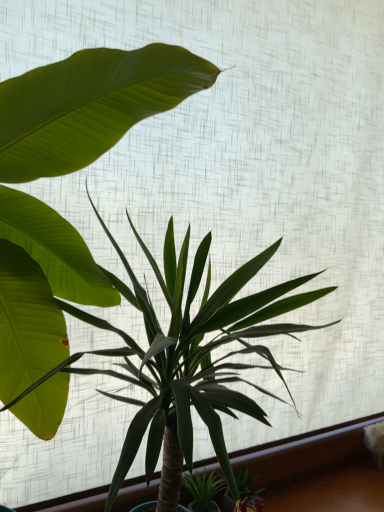
Question: From the image's perspective, would you say green leafy plant at center, the 1th houseplant from the right, is shown under green leafy plant at center, which appears as the first houseplant when viewed from the left?

Choices:
 (A) yes
 (B) no

Answer: (A)

Question: Considering the relative sizes of green leafy plant at center, the 1th houseplant from the right, and green leafy plant at center, which appears as the first houseplant when viewed from the left, in the image provided, is green leafy plant at center, the 1th houseplant from the right, wider than green leafy plant at center, which appears as the first houseplant when viewed from the left,?

Choices:
 (A) no
 (B) yes

Answer: (B)

Question: Is green leafy plant at center, which appears as the first houseplant when viewed from the left, at the back of green leafy plant at center, which is counted as the second houseplant, starting from the left?

Choices:
 (A) no
 (B) yes

Answer: (B)

Question: Does green leafy plant at center, which is counted as the second houseplant, starting from the left, appear on the right side of green leafy plant at center, which is counted as the second houseplant, starting from the right?

Choices:
 (A) no
 (B) yes

Answer: (B)

Question: Is green leafy plant at center, the 1th houseplant from the right, placed right next to green leafy plant at center, which appears as the first houseplant when viewed from the left?

Choices:
 (A) yes
 (B) no

Answer: (B)

Question: Is green leafy plant at center, which is counted as the second houseplant, starting from the left, thinner than green leafy plant at center, which is counted as the second houseplant, starting from the right?

Choices:
 (A) no
 (B) yes

Answer: (A)

Question: Would you say green leafy plant at center, which appears as the first houseplant when viewed from the left, contains green leafy plant at lower center?

Choices:
 (A) yes
 (B) no

Answer: (B)

Question: Could you tell me if green leafy plant at center, which is counted as the second houseplant, starting from the right, is turned towards green leafy plant at lower center?

Choices:
 (A) no
 (B) yes

Answer: (A)

Question: Is green leafy plant at center, which is counted as the second houseplant, starting from the right, far away from green leafy plant at lower center?

Choices:
 (A) no
 (B) yes

Answer: (A)

Question: Is green leafy plant at center, which is counted as the second houseplant, starting from the right, closer to the viewer compared to green leafy plant at lower center?

Choices:
 (A) no
 (B) yes

Answer: (B)

Question: From the image's perspective, is green leafy plant at center, which appears as the first houseplant when viewed from the left, on green leafy plant at lower center?

Choices:
 (A) no
 (B) yes

Answer: (B)

Question: Is green leafy plant at center, which is counted as the second houseplant, starting from the right, positioned behind green leafy plant at lower center?

Choices:
 (A) yes
 (B) no

Answer: (B)

Question: Does green leafy plant at center, which appears as the first houseplant when viewed from the left, have a greater height compared to green leafy plant at center, which is counted as the second houseplant, starting from the left?

Choices:
 (A) no
 (B) yes

Answer: (B)